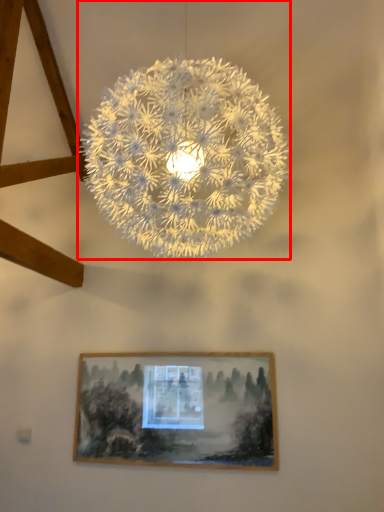
Question: From the image, what is the correct spatial relationship of lamp (annotated by the red box) in relation to picture frame?

Choices:
 (A) left
 (B) right

Answer: (B)